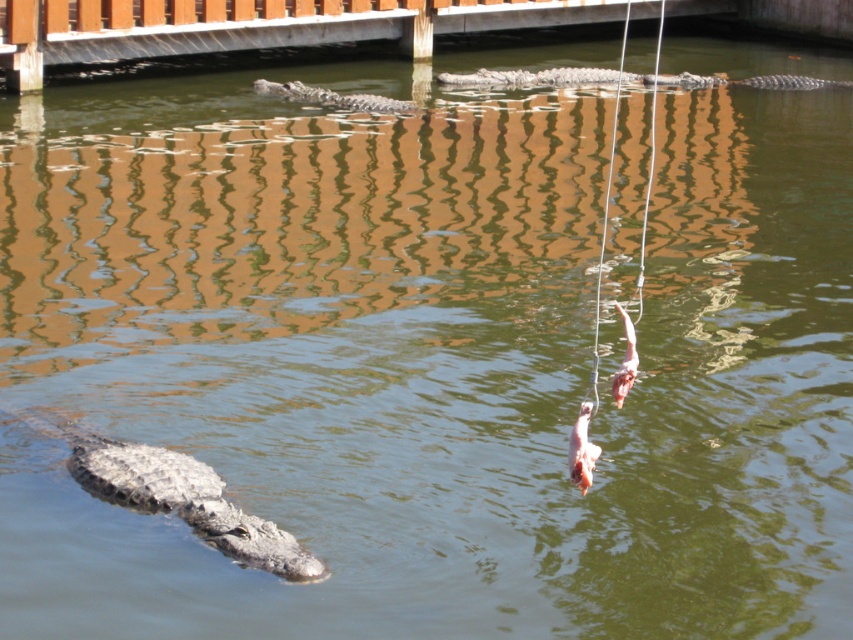
Is gray scaly crocodile at upper center to the right of gray textured crocodile at center from the viewer's perspective?

Correct, you'll find gray scaly crocodile at upper center to the right of gray textured crocodile at center.

Does gray scaly crocodile at upper center appear over gray textured crocodile at center?

Yes, gray scaly crocodile at upper center is above gray textured crocodile at center.

Locate an element on the screen. The image size is (853, 640). gray scaly crocodile at upper center is located at coordinates (627, 77).

Where is `gray scaly crocodile at upper center`? gray scaly crocodile at upper center is located at coordinates (627, 77).

Is gray scaly crocodile at lower left wider than gray scaly crocodile at upper center?

No, gray scaly crocodile at lower left is not wider than gray scaly crocodile at upper center.

Can you confirm if gray scaly crocodile at lower left is thinner than gray scaly crocodile at upper center?

Yes, gray scaly crocodile at lower left is thinner than gray scaly crocodile at upper center.

The width and height of the screenshot is (853, 640). Identify the location of gray scaly crocodile at lower left. (177, 496).

What do you see at coordinates (177, 496) in the screenshot?
I see `gray scaly crocodile at lower left` at bounding box center [177, 496].

Who is lower down, gray scaly crocodile at lower left or gray textured crocodile at center?

Positioned lower is gray scaly crocodile at lower left.

Does point (172, 492) come farther from viewer compared to point (408, 109)?

No, (172, 492) is in front of (408, 109).

This screenshot has width=853, height=640. What are the coordinates of `gray scaly crocodile at lower left` in the screenshot? It's located at pos(177,496).